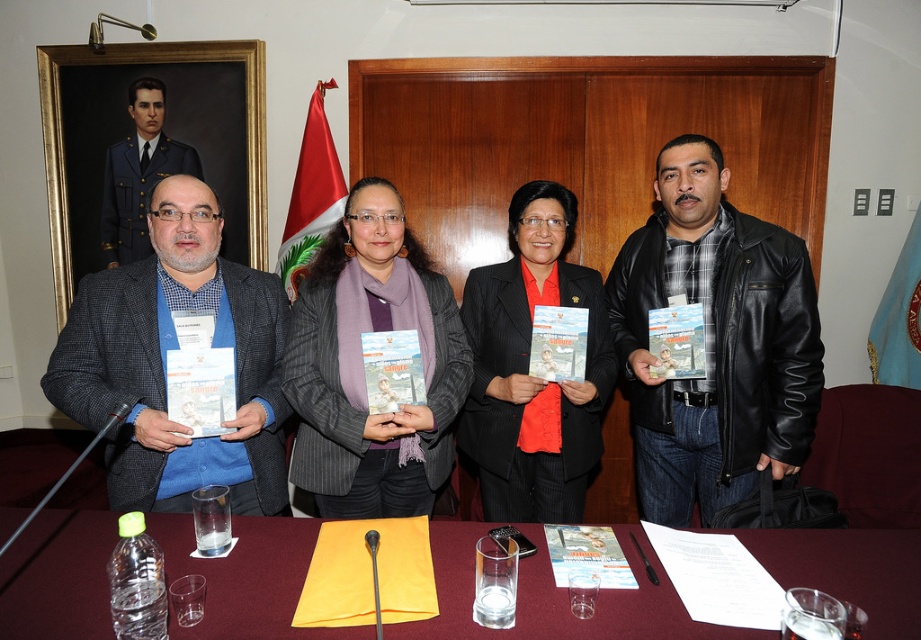
Who is lower down, maroon fabric table at center or black leather jacket at right?

maroon fabric table at center is below.

Looking at this image, is the position of maroon fabric table at center less distant than that of black leather jacket at right?

That is True.

Locate an element on the screen. Image resolution: width=921 pixels, height=640 pixels. maroon fabric table at center is located at coordinates (555, 596).

This screenshot has height=640, width=921. Find the location of `maroon fabric table at center`. maroon fabric table at center is located at coordinates (555, 596).

Does black leather jacket at right appear under gray pinstripe blazer at center?

Actually, black leather jacket at right is above gray pinstripe blazer at center.

Which is in front, point (675, 436) or point (354, 512)?

Positioned in front is point (354, 512).

Locate an element on the screen. black leather jacket at right is located at coordinates (715, 340).

Who is higher up, matte blue shirt at left or gray pinstripe blazer at center?

gray pinstripe blazer at center is above.

Which is behind, point (144, 337) or point (385, 483)?

Point (385, 483)

The height and width of the screenshot is (640, 921). I want to click on matte blue shirt at left, so click(x=165, y=364).